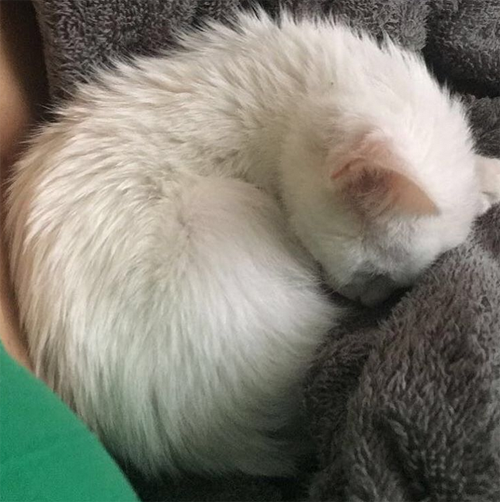
Where is `gray blanket`? gray blanket is located at coordinates (433, 408).